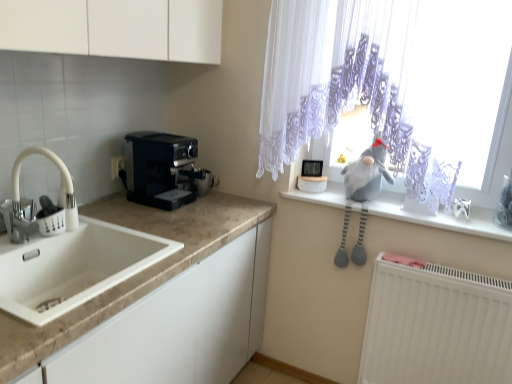
Question: From the image's perspective, is white marble countertop at lower left beneath white lace curtain at upper right?

Choices:
 (A) yes
 (B) no

Answer: (A)

Question: Is white lace curtain at upper right at the back of white marble countertop at lower left?

Choices:
 (A) no
 (B) yes

Answer: (A)

Question: Does white marble countertop at lower left appear on the left side of white lace curtain at upper right?

Choices:
 (A) no
 (B) yes

Answer: (B)

Question: From the image's perspective, is white marble countertop at lower left located above white lace curtain at upper right?

Choices:
 (A) yes
 (B) no

Answer: (B)

Question: From a real-world perspective, is white marble countertop at lower left beneath white lace curtain at upper right?

Choices:
 (A) yes
 (B) no

Answer: (A)

Question: Visually, is gray plush toy at upper right positioned to the left or to the right of white lace curtain at upper right?

Choices:
 (A) left
 (B) right

Answer: (B)

Question: Considering the positions of gray plush toy at upper right and white lace curtain at upper right in the image, is gray plush toy at upper right wider or thinner than white lace curtain at upper right?

Choices:
 (A) wide
 (B) thin

Answer: (A)

Question: From a real-world perspective, is gray plush toy at upper right above or below white lace curtain at upper right?

Choices:
 (A) above
 (B) below

Answer: (B)

Question: From the image's perspective, is gray plush toy at upper right above or below white lace curtain at upper right?

Choices:
 (A) below
 (B) above

Answer: (A)

Question: In the image, is gray plush toy at upper right positioned in front of or behind black plastic coffee maker at left?

Choices:
 (A) behind
 (B) front

Answer: (B)

Question: From their relative heights in the image, would you say gray plush toy at upper right is taller or shorter than black plastic coffee maker at left?

Choices:
 (A) tall
 (B) short

Answer: (A)

Question: Is gray plush toy at upper right to the left or to the right of black plastic coffee maker at left in the image?

Choices:
 (A) left
 (B) right

Answer: (B)

Question: Is point (361, 211) closer or farther from the camera than point (141, 134)?

Choices:
 (A) closer
 (B) farther

Answer: (A)

Question: From a real-world perspective, relative to white matte faucet at left, is white plastic electric outlet at left vertically above or below?

Choices:
 (A) below
 (B) above

Answer: (A)

Question: Is white plastic electric outlet at left inside or outside of white matte faucet at left?

Choices:
 (A) inside
 (B) outside

Answer: (B)